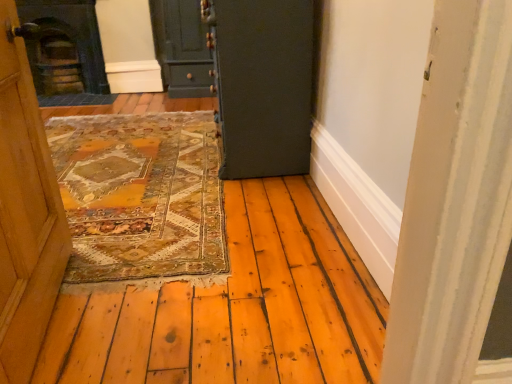
Question: In which direction should I rotate to look at matte dark green cabinet at upper center, which ranks as the 1th door in left-to-right order?

Choices:
 (A) left
 (B) right

Answer: (A)

Question: Can you confirm if dark gray stone fireplace at upper left is wider than matte dark green cabinet at upper center, acting as the 1th door starting from the back?

Choices:
 (A) yes
 (B) no

Answer: (B)

Question: Does dark gray stone fireplace at upper left turn towards matte dark green cabinet at upper center, acting as the 1th door starting from the back?

Choices:
 (A) no
 (B) yes

Answer: (A)

Question: Considering the relative sizes of dark gray stone fireplace at upper left and matte dark green cabinet at upper center, which ranks as the 1th door in left-to-right order, in the image provided, is dark gray stone fireplace at upper left shorter than matte dark green cabinet at upper center, which ranks as the 1th door in left-to-right order,?

Choices:
 (A) no
 (B) yes

Answer: (A)

Question: Does dark gray stone fireplace at upper left have a lesser width compared to matte dark green cabinet at upper center, acting as the 1th door starting from the back?

Choices:
 (A) yes
 (B) no

Answer: (A)

Question: Is dark gray stone fireplace at upper left further to the viewer compared to matte dark green cabinet at upper center, acting as the 1th door starting from the back?

Choices:
 (A) no
 (B) yes

Answer: (B)

Question: Is the position of dark gray stone fireplace at upper left less distant than that of matte dark green cabinet at upper center, which is the second door in front-to-back order?

Choices:
 (A) yes
 (B) no

Answer: (B)

Question: From a real-world perspective, is matte dark green cabinet at upper center, which is the second door in front-to-back order, on top of dark gray stone fireplace at upper left?

Choices:
 (A) no
 (B) yes

Answer: (A)

Question: Is matte dark green cabinet at upper center, which is the second door in front-to-back order, surrounding dark gray stone fireplace at upper left?

Choices:
 (A) yes
 (B) no

Answer: (B)

Question: Considering the relative positions of matte dark green cabinet at upper center, which is the second door in front-to-back order, and dark gray stone fireplace at upper left in the image provided, is matte dark green cabinet at upper center, which is the second door in front-to-back order, to the right of dark gray stone fireplace at upper left from the viewer's perspective?

Choices:
 (A) yes
 (B) no

Answer: (A)

Question: From a real-world perspective, is matte dark green cabinet at upper center, acting as the 1th door starting from the back, under dark gray stone fireplace at upper left?

Choices:
 (A) no
 (B) yes

Answer: (B)

Question: From the image's perspective, is matte dark green cabinet at upper center, placed as the second door when sorted from right to left, located above dark gray stone fireplace at upper left?

Choices:
 (A) yes
 (B) no

Answer: (A)

Question: Is matte dark green cabinet at upper center, placed as the second door when sorted from right to left, behind dark gray stone fireplace at upper left?

Choices:
 (A) yes
 (B) no

Answer: (B)

Question: From a real-world perspective, does dark gray stone fireplace at upper left sit lower than dark green wood at center, the second door viewed from the left?

Choices:
 (A) yes
 (B) no

Answer: (A)